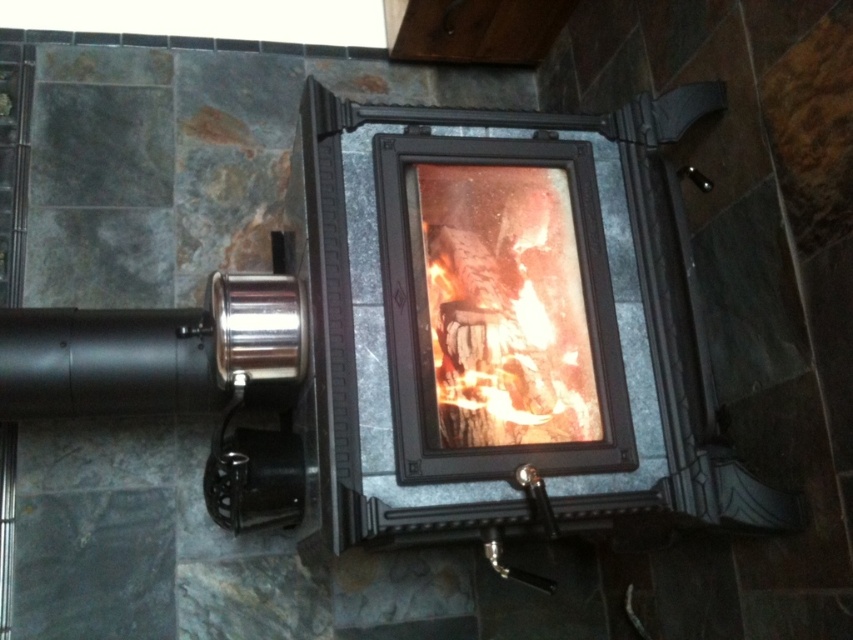
Can you confirm if matte black fireplace at center is positioned below orange glowing wood at center?

Actually, matte black fireplace at center is above orange glowing wood at center.

Consider the image. Is matte black fireplace at center smaller than orange glowing wood at center?

No, matte black fireplace at center is not smaller than orange glowing wood at center.

Does point (550, 156) lie in front of point (538, 198)?

That is False.

Locate an element on the screen. This screenshot has height=640, width=853. matte black fireplace at center is located at coordinates (502, 321).